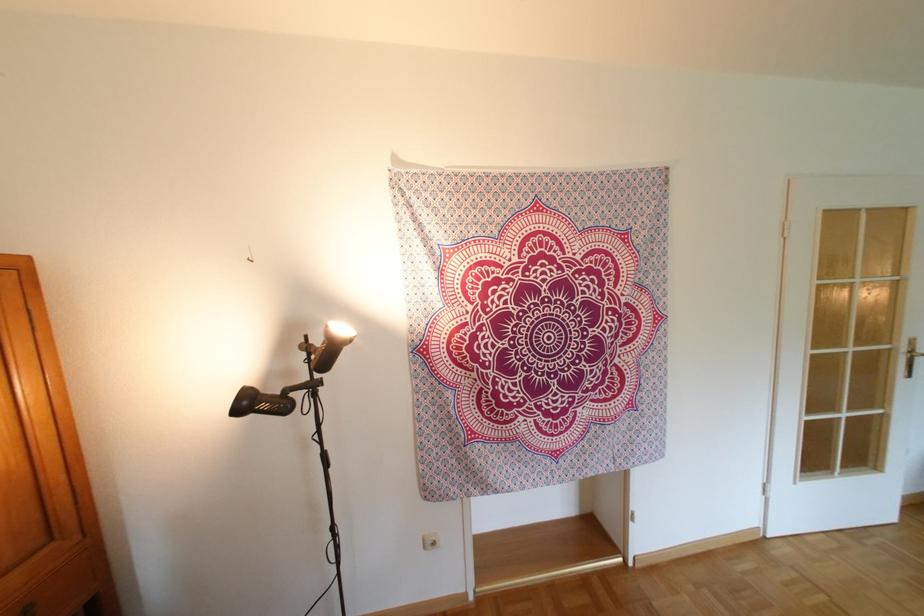
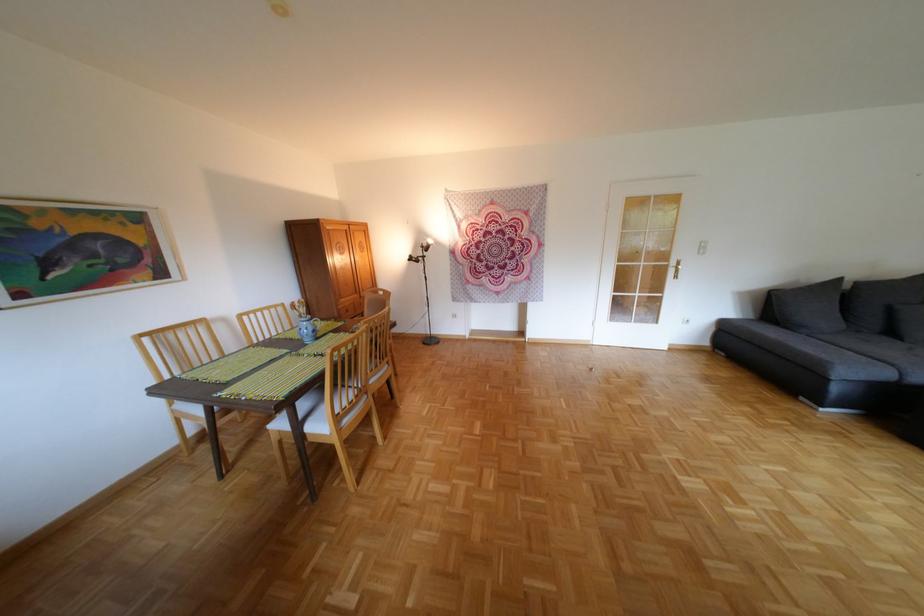
Where in the second image is the point corresponding to pixel 259 403 from the first image?

(423, 257)